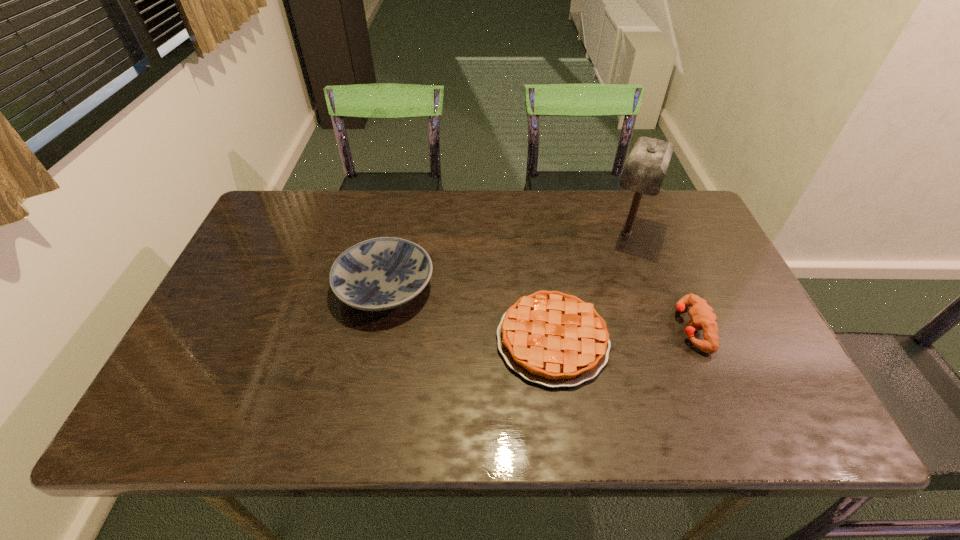
I want to click on mallet, so click(x=645, y=169).

This screenshot has width=960, height=540. Find the location of `the leftmost object`. the leftmost object is located at coordinates (382, 273).

Where is `puncher`? puncher is located at coordinates tap(702, 315).

The image size is (960, 540). Find the location of `pie`. pie is located at coordinates (554, 339).

This screenshot has height=540, width=960. I want to click on the shortest object, so click(x=554, y=339).

Where is `free spot located on the left of the mallet`? The height and width of the screenshot is (540, 960). free spot located on the left of the mallet is located at coordinates (554, 233).

Where is `vacant space located on the front of the leftmost object`? vacant space located on the front of the leftmost object is located at coordinates (373, 347).

In order to click on blank space located with the gloves of the puncher facing forward in this screenshot , I will do `click(638, 328)`.

Locate an element on the screen. blank space located 0.110m with the gloves of the puncher facing forward is located at coordinates (631, 328).

Locate an element on the screen. The height and width of the screenshot is (540, 960). vacant space located 0.170m with the gloves of the puncher facing forward is located at coordinates (606, 328).